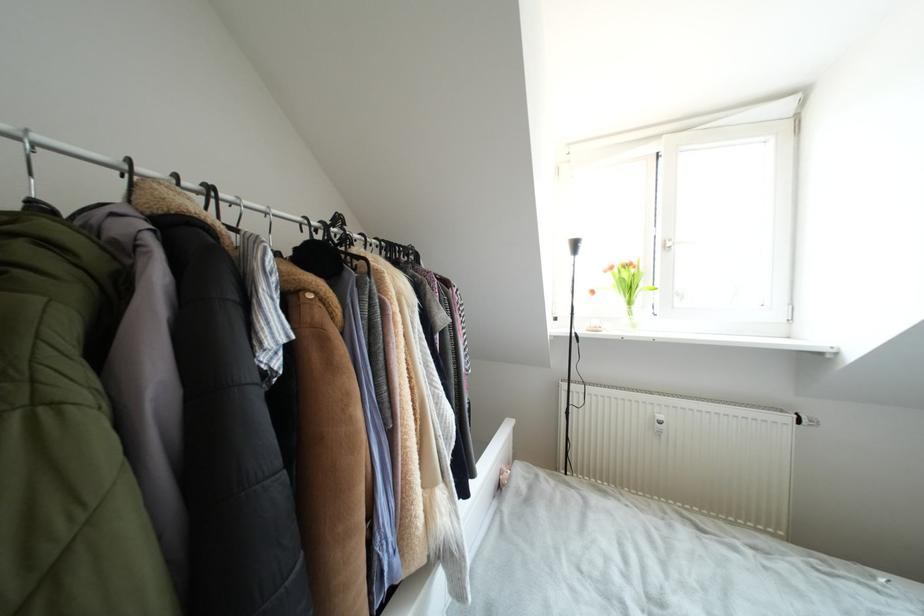
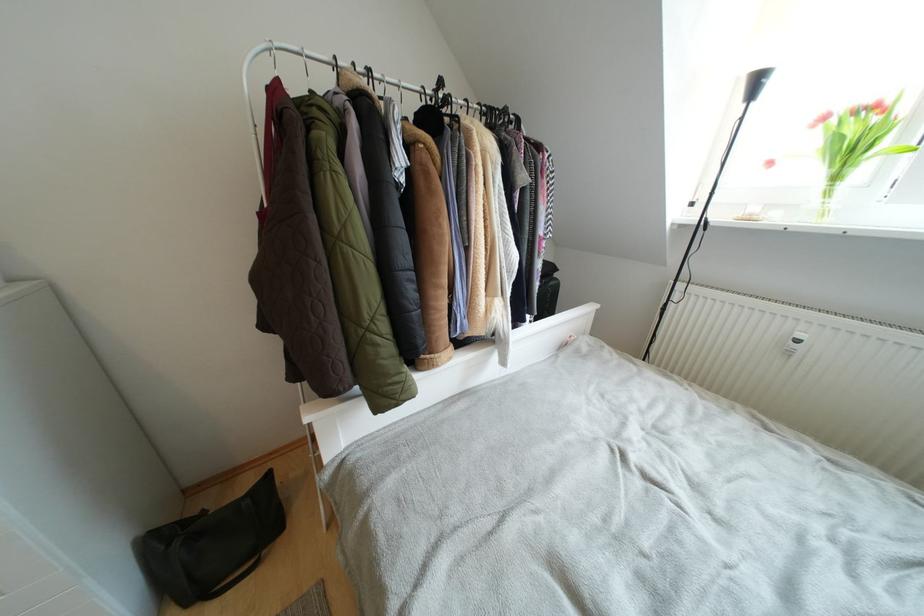
Where in the second image is the point corresponding to point 635,307 from the first image?

(840, 182)